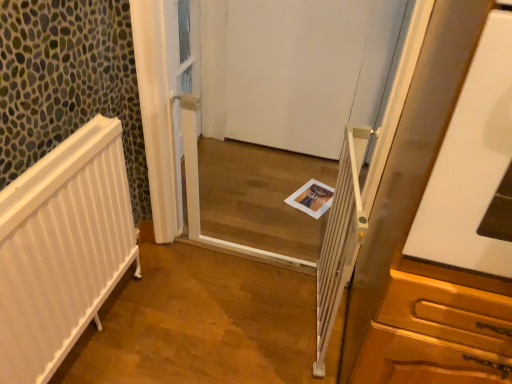
What are the coordinates of `free point below white matte radiator at left (from a real-world perspective)` in the screenshot? It's located at (96, 329).